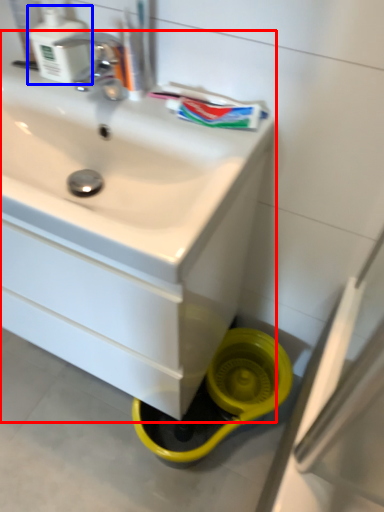
Question: Which object is closer to the camera taking this photo, sink (highlighted by a red box) or soap dispenser (highlighted by a blue box)?

Choices:
 (A) sink
 (B) soap dispenser

Answer: (A)